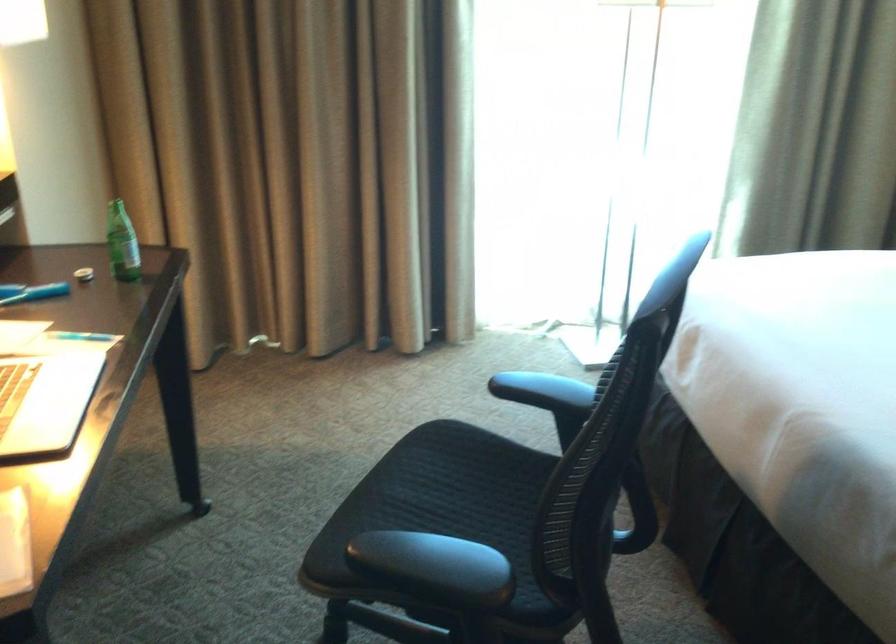
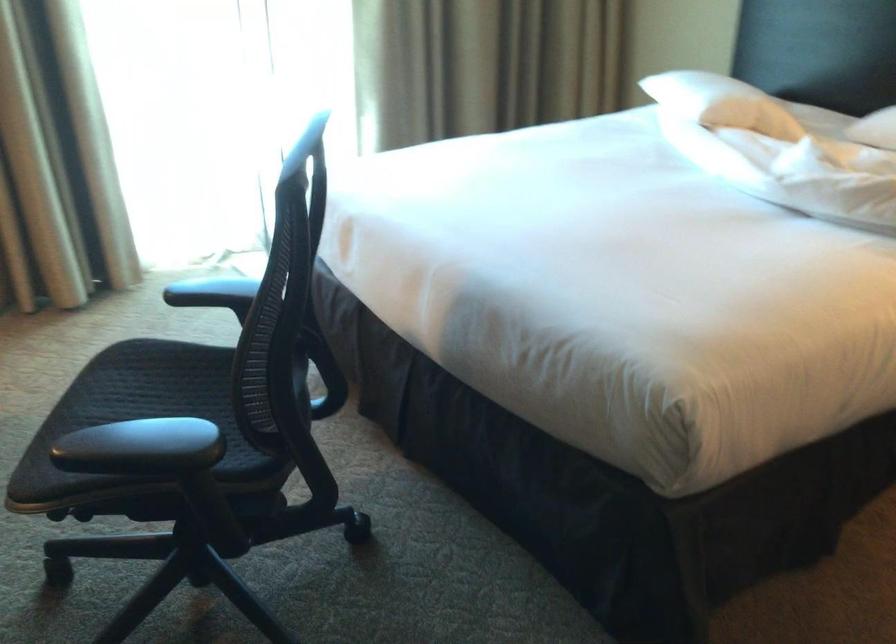
Where in the second image is the point corresponding to pixel 463 471 from the first image?

(159, 379)